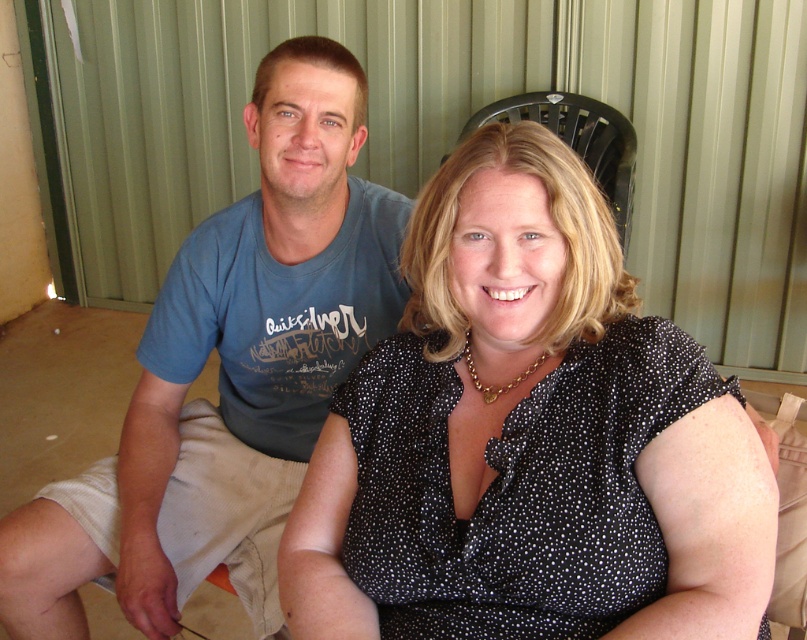
Who is more distant from viewer, (487,611) or (611,154)?

The point (611,154) is behind.

Describe the element at coordinates (509, 433) in the screenshot. I see `black dotted blouse at center` at that location.

Locate an element on the screen. The height and width of the screenshot is (640, 807). black dotted blouse at center is located at coordinates (509, 433).

Does black dotted blouse at center have a lesser width compared to blue cotton t-shirt at left?

Indeed, black dotted blouse at center has a lesser width compared to blue cotton t-shirt at left.

Which is more to the left, black dotted blouse at center or blue cotton t-shirt at left?

Positioned to the left is blue cotton t-shirt at left.

Where is `black dotted blouse at center`? black dotted blouse at center is located at coordinates (509, 433).

Is blue cotton t-shirt at left below black plastic chair at upper center?

Yes, blue cotton t-shirt at left is below black plastic chair at upper center.

Between blue cotton t-shirt at left and black plastic chair at upper center, which one appears on the right side from the viewer's perspective?

From the viewer's perspective, black plastic chair at upper center appears more on the right side.

This screenshot has height=640, width=807. I want to click on blue cotton t-shirt at left, so click(x=228, y=372).